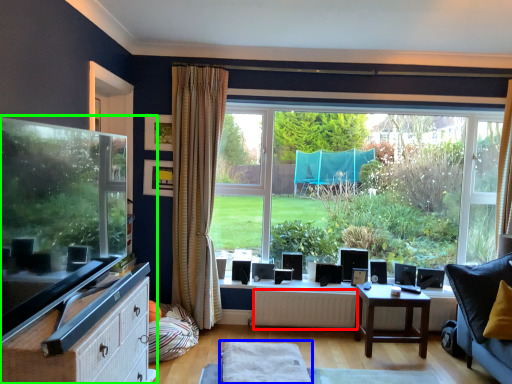
Question: Estimate the real-world distances between objects in this image. Which object is farther from radiator (highlighted by a red box), plain (highlighted by a blue box) or entertainment center (highlighted by a green box)?

Choices:
 (A) plain
 (B) entertainment center

Answer: (B)